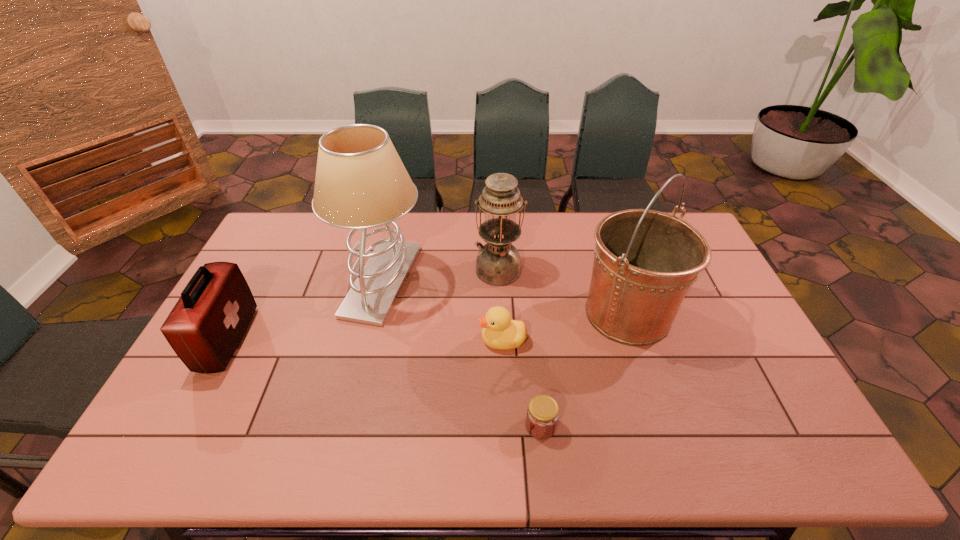
At what (x,y) coordinates should I click in order to perform the action: click on free space at the near edge. Please return your answer as a coordinate pair (x, y). Image resolution: width=960 pixels, height=540 pixels. Looking at the image, I should click on (677, 467).

Find the location of a particular element. This screenshot has width=960, height=540. free spot at the left edge of the desktop is located at coordinates (206, 411).

Locate an element on the screen. vacant region at the right edge of the desktop is located at coordinates (686, 306).

At what (x,y) coordinates should I click in order to perform the action: click on free space at the far left corner of the desktop. Please return your answer as a coordinate pair (x, y). Looking at the image, I should click on (309, 219).

The image size is (960, 540). What are the coordinates of `free location at the near left corner of the desktop` in the screenshot? It's located at (164, 433).

This screenshot has height=540, width=960. Identify the location of free space between the duck and the first aid kit. (365, 340).

Locate an element on the screen. free spot between the second object from left to right and the rightmost object is located at coordinates (505, 297).

Find the location of a particular element. The height and width of the screenshot is (540, 960). vacant space that's between the leftmost object and the bucket is located at coordinates (427, 326).

Find the location of a particular element. vacant space that is in between the bucket and the leftmost object is located at coordinates (427, 326).

Where is `free space between the table lamp and the jam`? free space between the table lamp and the jam is located at coordinates (462, 353).